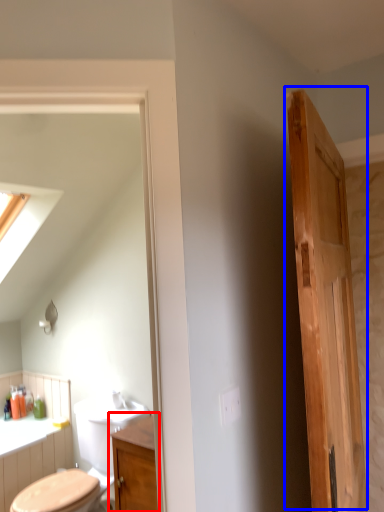
Question: Which object appears closest to the camera in this image, bathroom cabinet (highlighted by a red box) or door (highlighted by a blue box)?

Choices:
 (A) bathroom cabinet
 (B) door

Answer: (B)